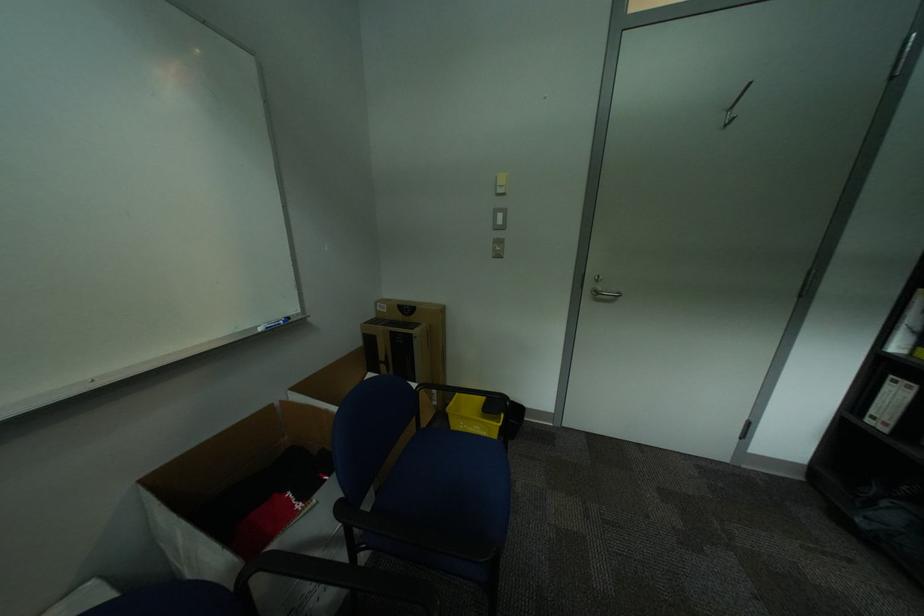
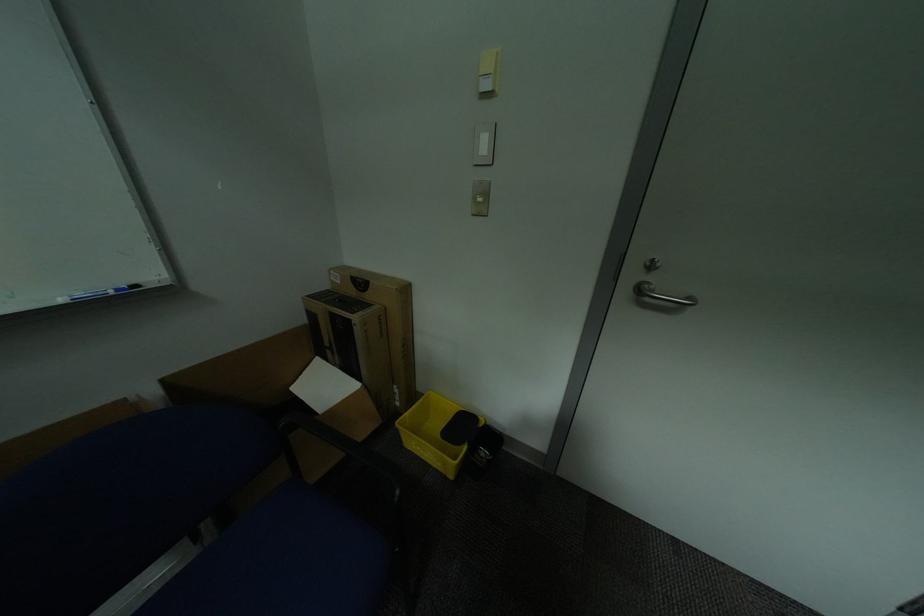
In a continuous first-person perspective shot, in which direction is the camera moving?

The cameraman moved toward right, forward.